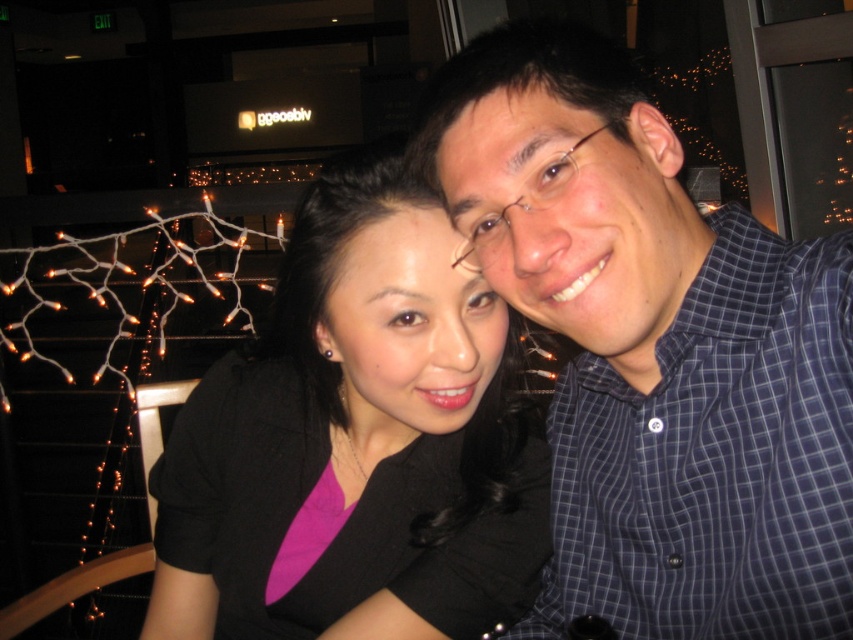
Which is above, blue checkered shirt at center or black matte shirt at center?

Positioned higher is blue checkered shirt at center.

Is point (630, 204) in front of point (305, 513)?

Yes, it is in front of point (305, 513).

Does point (668, 205) come in front of point (432, 506)?

Yes, point (668, 205) is in front of point (432, 506).

Where is `blue checkered shirt at center`? This screenshot has height=640, width=853. blue checkered shirt at center is located at coordinates (654, 349).